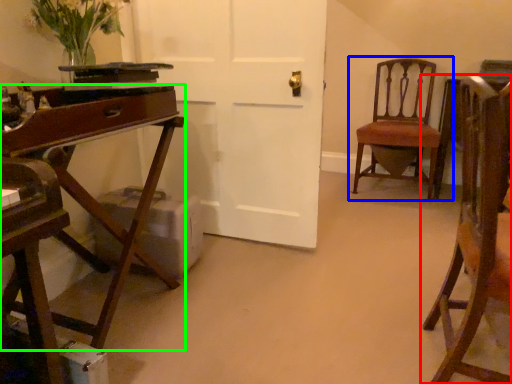
Question: Which is nearer to the chair (highlighted by a red box)? chair (highlighted by a blue box) or desk (highlighted by a green box).

Choices:
 (A) chair
 (B) desk

Answer: (B)